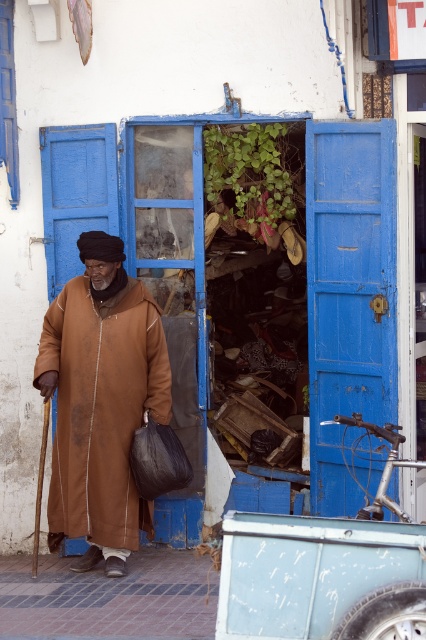
You are a delivery person who needs to enter the shop through the blue wooden door at right. You are wearing a brown matte robe at center. Can you pass through the door without removing your robe?

The blue wooden door at right has a lesser width compared to brown matte robe at center, so the door is narrower than the robe. Therefore, you may not be able to pass through the door without adjusting your robe or finding a wider entrance.

You are a delivery person who needs to enter the shop through the blue wooden door at right. However, you are currently standing in front of the brown matte robe at center. Can you walk straight ahead to reach the door without moving around the robe?

The blue wooden door at right is positioned over brown matte robe at center, meaning the door is above the robe in the image. Since the robe is in the foreground, the door is likely behind it. Therefore, you can walk straight ahead towards the door as it is not blocked by the robe.

In the scene shown: You are standing in front of a small shop with blue shutters and a partially open door. You need to enter the shop but are carrying a large box that is 6 meters long. Can you safely walk through the blue wooden door at right without hitting the top of the box?

The blue wooden door at right is 5.95 meters away from viewer. Since the box is 6 meters long, it is slightly longer than the distance to the door, so you might hit the top when trying to enter. Consider tilting the box or finding another entrance.